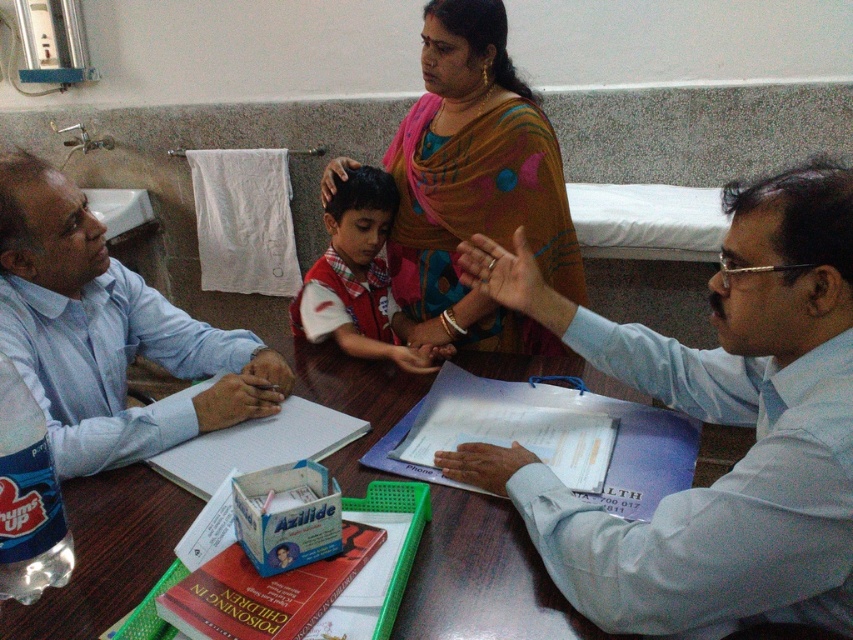
You are a patient entering the clinic and need to sit down. There is a wooden table at center and a red plaid shirt at center in your line of sight. Which object should you approach to find a seat?

The wooden table at center is closer to the viewer than the red plaid shirt at center, so you should approach the wooden table at center to find a seat.

In the medical consultation scene, there is a light blue shirt at left and a red plaid shirt at center. Which of these two individuals is closer to the viewer?

The light blue shirt at left is closer to the viewer because it is in front of the red plaid shirt at center.

You are a nurse who needs to deliver a medication to the patient. The medication must be placed exactly between the light blue shirt at left and the red plaid shirt at center. How far apart should you place the medication from each shirt?

The light blue shirt at left and red plaid shirt at center are 15.67 inches apart. To place the medication exactly between them, you should position it 7.835 inches from each shirt.